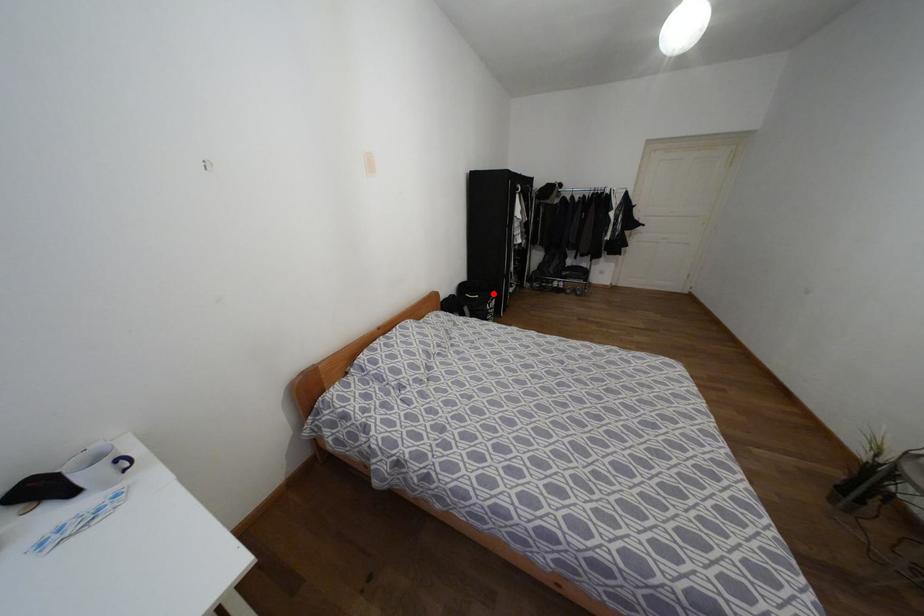
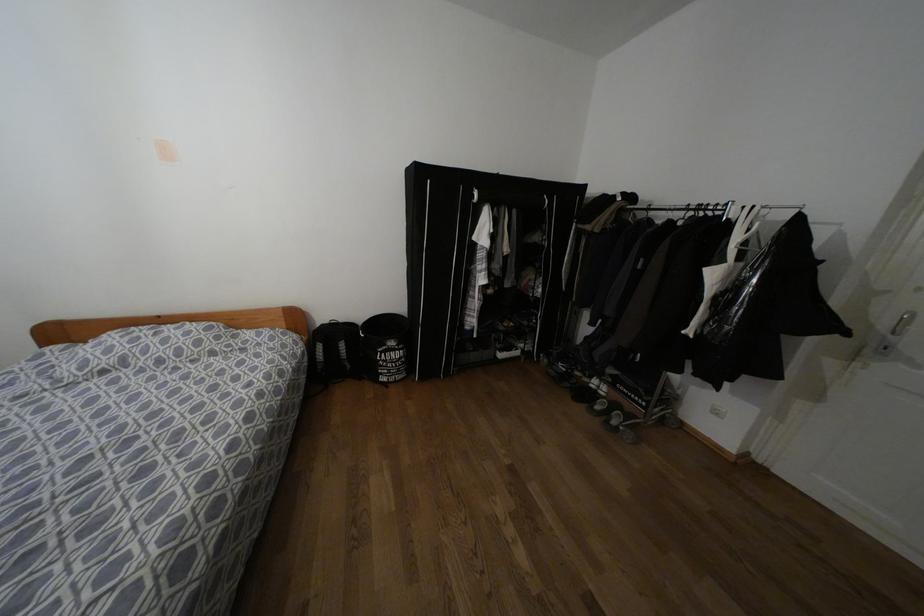
Find the pixel in the second image that matches the highlighted location in the first image.

(391, 342)